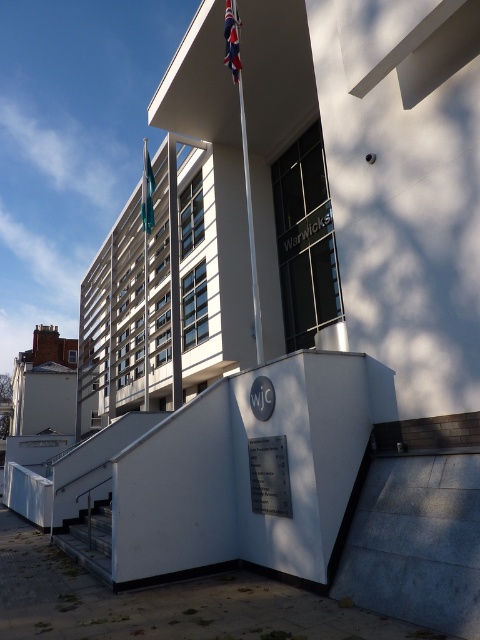
Question: Can you confirm if polished metal flag pole at center is positioned to the right of union jack fabric flag at upper center?

Choices:
 (A) yes
 (B) no

Answer: (A)

Question: Which point is farther from the camera taking this photo?

Choices:
 (A) coord(78,550)
 (B) coord(236,19)

Answer: (B)

Question: Which of the following is the closest to the observer?

Choices:
 (A) (144, 204)
 (B) (145, 262)
 (C) (251, 196)
 (D) (228, 28)

Answer: (D)

Question: Based on their relative distances, which object is farther from the polished metal flag pole at center?

Choices:
 (A) union jack fabric flag at upper center
 (B) metallic flag pole at center

Answer: (B)

Question: Is metallic flag pole at center bigger than blue fabric flag at upper left?

Choices:
 (A) no
 (B) yes

Answer: (B)

Question: Can you confirm if metallic gray staircase at lower left is bigger than union jack fabric flag at upper center?

Choices:
 (A) yes
 (B) no

Answer: (A)